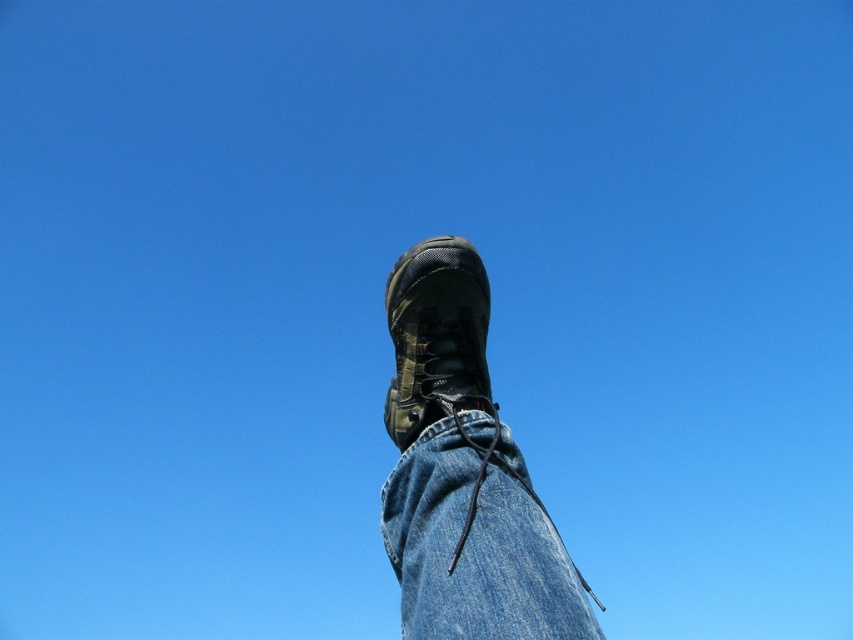
You are trying to decide whether to wear the denim at center or the matte black boot at center for a hike. Based on their height, which one is taller?

The matte black boot at center is taller than the denim at center, so it would be the better choice for a hike.

You are a tailor trying to determine if the denim at center can cover the matte black boot at center. Based on the size comparison provided, what is your assessment?

The denim at center is smaller than the matte black boot at center, so it cannot fully cover the boot.

You are a photographer trying to focus on the hiking boot in the image. You notice a point at coordinates point (476, 541). What material is located at that point?

The point (476, 541) marks denim at center, so the material at that point is denim.